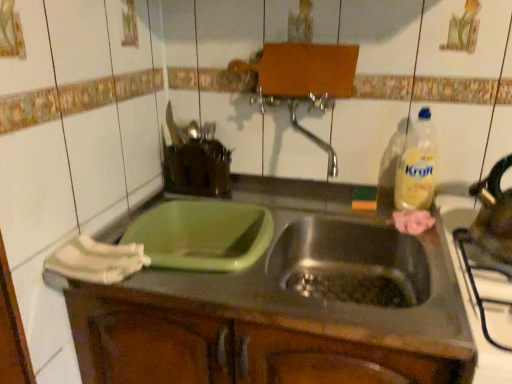
Question: Can you confirm if shiny metallic tea pot at right is wider than green plastic container at center-left?

Choices:
 (A) no
 (B) yes

Answer: (A)

Question: From the image's perspective, would you say shiny metallic tea pot at right is shown under green plastic container at center-left?

Choices:
 (A) yes
 (B) no

Answer: (B)

Question: Considering the relative positions of shiny metallic tea pot at right and green plastic container at center-left in the image provided, is shiny metallic tea pot at right in front of green plastic container at center-left?

Choices:
 (A) yes
 (B) no

Answer: (B)

Question: Is shiny metallic tea pot at right at the left side of green plastic container at center-left?

Choices:
 (A) yes
 (B) no

Answer: (B)

Question: Is shiny metallic tea pot at right further to camera compared to green plastic container at center-left?

Choices:
 (A) no
 (B) yes

Answer: (B)

Question: From the image's perspective, relative to shiny metallic tea pot at right, is green plastic container at center-left above or below?

Choices:
 (A) below
 (B) above

Answer: (A)

Question: Considering the positions of green plastic container at center-left and shiny metallic tea pot at right in the image, is green plastic container at center-left bigger or smaller than shiny metallic tea pot at right?

Choices:
 (A) small
 (B) big

Answer: (B)

Question: Does point (404, 337) appear closer or farther from the camera than point (504, 226)?

Choices:
 (A) closer
 (B) farther

Answer: (A)

Question: From a real-world perspective, is green plastic container at center-left physically located above or below shiny metallic tea pot at right?

Choices:
 (A) below
 (B) above

Answer: (A)

Question: Looking at their shapes, would you say stainless steel kettle at right is wider or thinner than yellow plastic bottle at right?

Choices:
 (A) thin
 (B) wide

Answer: (B)

Question: From the image's perspective, relative to yellow plastic bottle at right, is stainless steel kettle at right above or below?

Choices:
 (A) above
 (B) below

Answer: (B)

Question: Considering the relative positions of stainless steel kettle at right and yellow plastic bottle at right in the image provided, is stainless steel kettle at right to the left or to the right of yellow plastic bottle at right?

Choices:
 (A) right
 (B) left

Answer: (A)

Question: Is stainless steel kettle at right in front of or behind yellow plastic bottle at right in the image?

Choices:
 (A) behind
 (B) front

Answer: (B)

Question: From the image's perspective, relative to shiny metallic tea pot at right, is yellow plastic bottle at right above or below?

Choices:
 (A) below
 (B) above

Answer: (B)

Question: Is point (396, 183) positioned closer to the camera than point (479, 223)?

Choices:
 (A) farther
 (B) closer

Answer: (A)